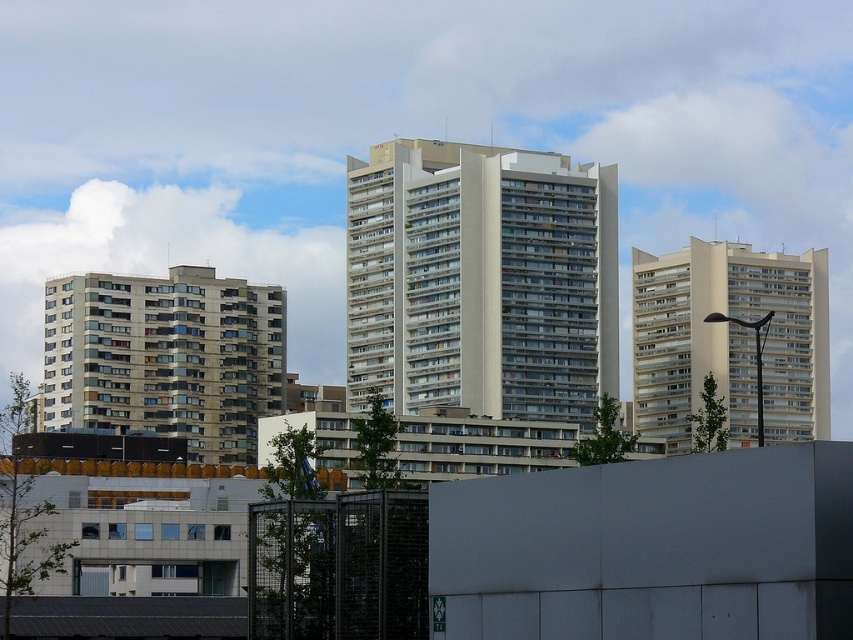
Consider the image. Between white smooth building at center and white smooth building at right, which one is positioned lower?

white smooth building at right is below.

Which is in front, point (613, 196) or point (685, 358)?

Point (613, 196) is in front.

Which is in front, point (460, 371) or point (730, 268)?

Point (460, 371) is more forward.

Locate an element on the screen. white smooth building at center is located at coordinates (480, 280).

Does beige concrete building at left appear over white smooth building at right?

Actually, beige concrete building at left is below white smooth building at right.

Can you confirm if beige concrete building at left is bigger than white smooth building at right?

Incorrect, beige concrete building at left is not larger than white smooth building at right.

Is point (218, 280) positioned behind point (656, 268)?

No, (218, 280) is closer to viewer.

Where is `beige concrete building at left`? beige concrete building at left is located at coordinates (165, 356).

Is white smooth building at center smaller than beige concrete building at left?

Indeed, white smooth building at center has a smaller size compared to beige concrete building at left.

Does white smooth building at center have a larger size compared to beige concrete building at left?

No.

Locate an element on the screen. The height and width of the screenshot is (640, 853). white smooth building at center is located at coordinates (480, 280).

Image resolution: width=853 pixels, height=640 pixels. Identify the location of white smooth building at center. (480, 280).